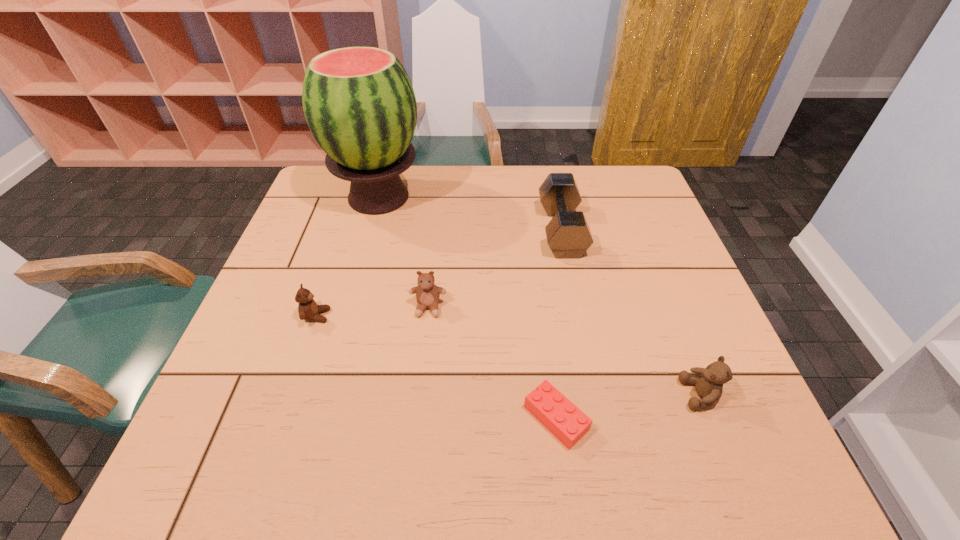
Where is `watermelon`? watermelon is located at coordinates (359, 103).

Where is `dumbbell`? dumbbell is located at coordinates (568, 234).

What are the coordinates of `the second teddy bear from right to left` in the screenshot? It's located at (427, 293).

This screenshot has height=540, width=960. I want to click on the rightmost object, so click(x=709, y=385).

Where is `the rightmost teddy bear`? This screenshot has width=960, height=540. the rightmost teddy bear is located at coordinates (709, 385).

Where is `the leftmost teddy bear`? the leftmost teddy bear is located at coordinates (308, 309).

Locate an element on the screen. The width and height of the screenshot is (960, 540). the shortest object is located at coordinates (558, 414).

The height and width of the screenshot is (540, 960). Identify the location of vacant space located 0.090m on the front of the watermelon. (364, 248).

What are the coordinates of `free location located on the front of the dumbbell` in the screenshot? It's located at (591, 373).

Locate an element on the screen. vacant space located on the front-facing side of the third object from left to right is located at coordinates (420, 390).